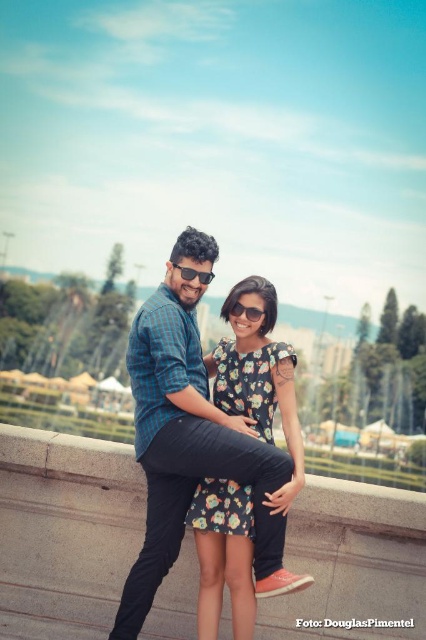
Question: Which object appears closest to the camera in this image?

Choices:
 (A) sunglasses at center
 (B) black plastic sunglasses at upper center

Answer: (A)

Question: Does floral-patterned fabric dress at center have a larger size compared to sunglasses at center?

Choices:
 (A) no
 (B) yes

Answer: (B)

Question: Which object is positioned farthest from the black plastic sunglasses at upper center?

Choices:
 (A) sunglasses at center
 (B) floral-patterned fabric dress at center

Answer: (B)

Question: Among these points, which one is farthest from the camera?

Choices:
 (A) (250, 321)
 (B) (176, 264)
 (C) (281, 372)

Answer: (B)

Question: Is floral-patterned fabric dress at center above black plastic sunglasses at upper center?

Choices:
 (A) yes
 (B) no

Answer: (B)

Question: Can you confirm if sunglasses at center is positioned above black plastic sunglasses at upper center?

Choices:
 (A) yes
 (B) no

Answer: (B)